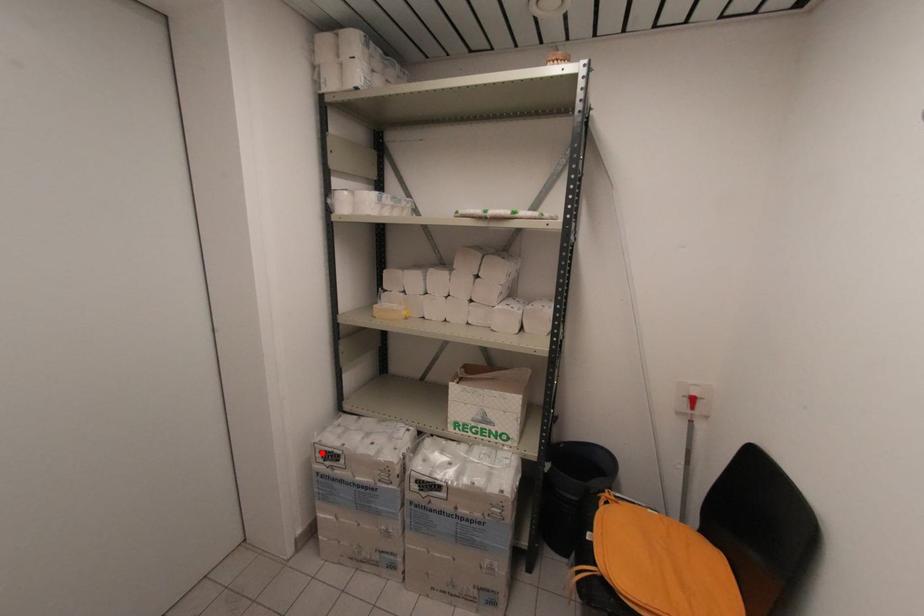
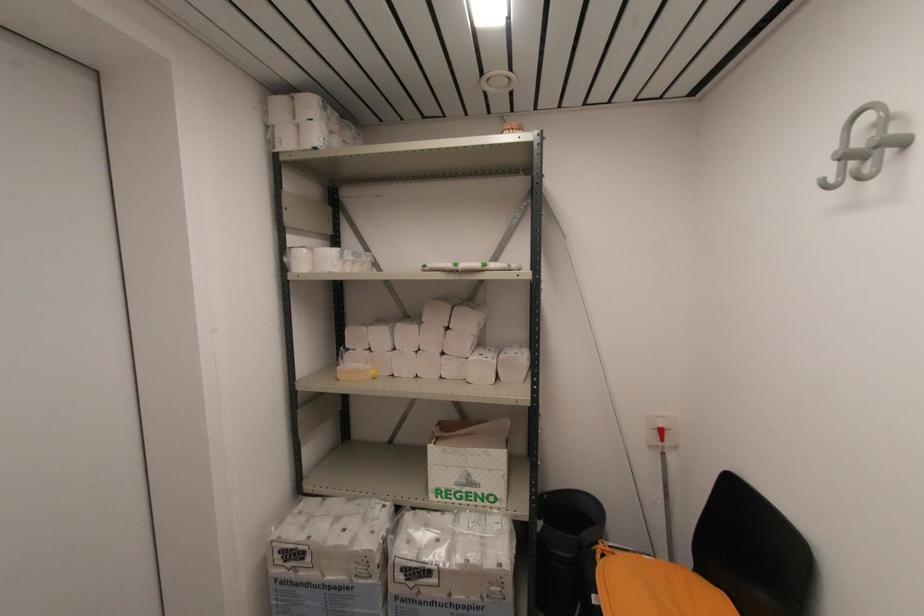
The point at the highlighted location is marked in the first image. Where is the corresponding point in the second image?

(281, 553)